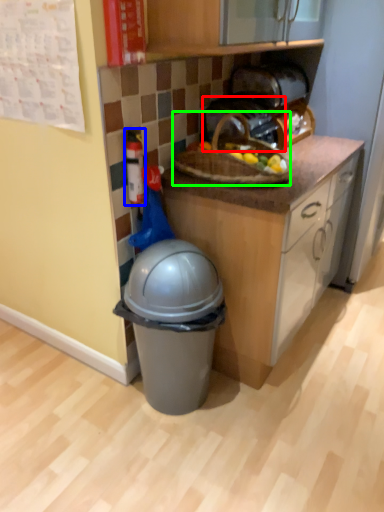
Question: Which object is positioned farthest from toaster (highlighted by a red box)? Select from toy (highlighted by a blue box) and picnic basket (highlighted by a green box).

Choices:
 (A) toy
 (B) picnic basket

Answer: (A)